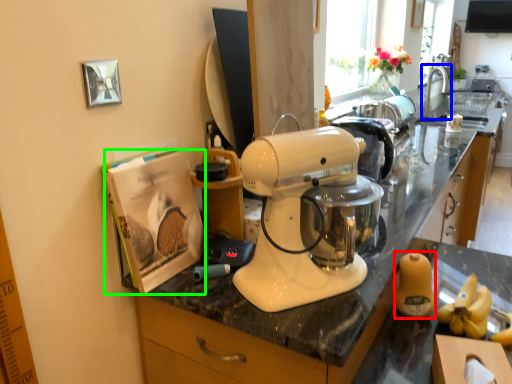
Question: Which object is the farthest from food (highlighted by a red box)? Choose among these: faucet (highlighted by a blue box) or magazine (highlighted by a green box).

Choices:
 (A) faucet
 (B) magazine

Answer: (A)